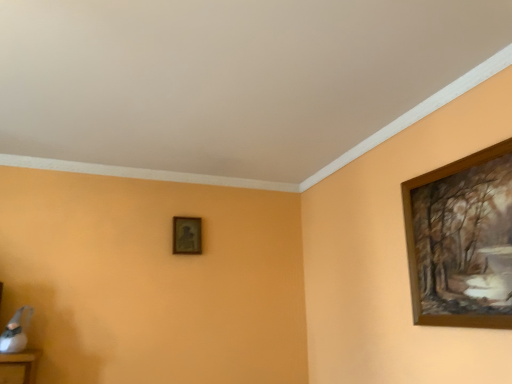
Question: Is wooden picture frame at upper right, which ranks as the second picture frame in back-to-front order, taller or shorter than matte gold picture frame at center, which is counted as the first picture frame, starting from the back?

Choices:
 (A) short
 (B) tall

Answer: (B)

Question: From the image's perspective, relative to matte gold picture frame at center, arranged as the 1th picture frame when viewed from the left, is wooden picture frame at upper right, acting as the first picture frame starting from the front, above or below?

Choices:
 (A) below
 (B) above

Answer: (B)

Question: In the image, is wooden picture frame at upper right, the 1th picture frame from the right, positioned in front of or behind matte gold picture frame at center, the 2th picture frame viewed from the front?

Choices:
 (A) front
 (B) behind

Answer: (A)

Question: Based on their sizes in the image, would you say matte gold picture frame at center, arranged as the 1th picture frame when viewed from the left, is bigger or smaller than wooden picture frame at upper right, acting as the first picture frame starting from the front?

Choices:
 (A) big
 (B) small

Answer: (B)

Question: In the image, is matte gold picture frame at center, which is counted as the first picture frame, starting from the back, on the left side or the right side of wooden picture frame at upper right, which ranks as the second picture frame in back-to-front order?

Choices:
 (A) right
 (B) left

Answer: (B)

Question: Is matte gold picture frame at center, arranged as the 1th picture frame when viewed from the left, taller or shorter than wooden picture frame at upper right, which is the second picture frame from left to right?

Choices:
 (A) short
 (B) tall

Answer: (A)

Question: Considering the positions of point (184, 231) and point (481, 294), is point (184, 231) closer or farther from the camera than point (481, 294)?

Choices:
 (A) farther
 (B) closer

Answer: (A)